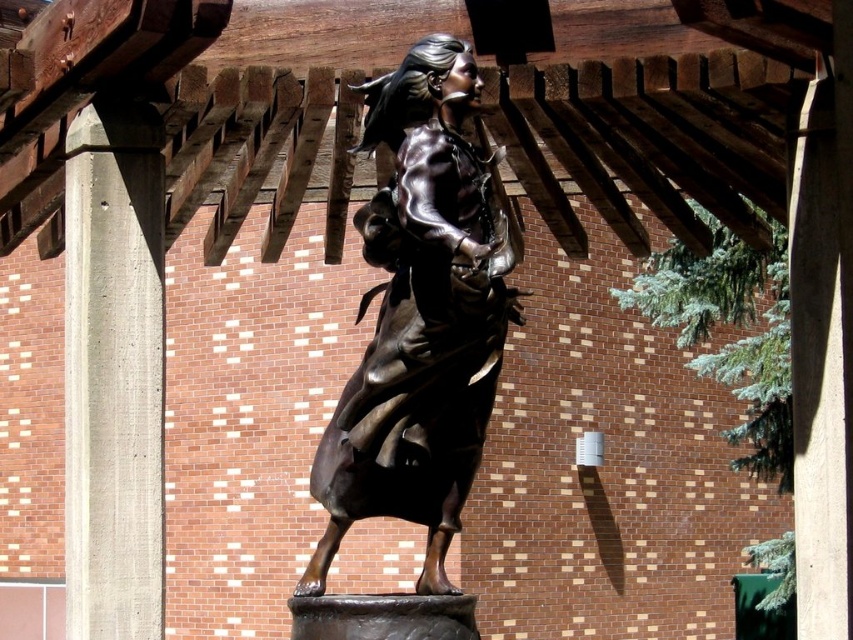
In order to click on shiny bronze statue at center in this screenshot , I will do `click(421, 316)`.

Which is in front, point (434, 140) or point (120, 266)?

Point (434, 140) is in front.

Where is `shiny bronze statue at center`? The width and height of the screenshot is (853, 640). shiny bronze statue at center is located at coordinates (421, 316).